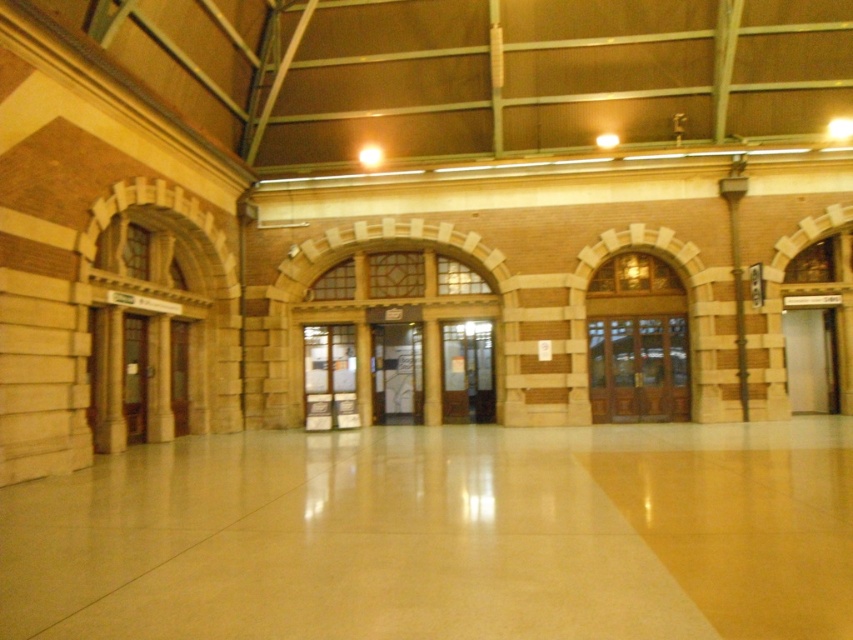
Question: Which point is farther to the camera?

Choices:
 (A) translucent glass door at center
 (B) satin silver door at right

Answer: (A)

Question: Among these objects, which one is nearest to the camera?

Choices:
 (A) brown wooden door at center
 (B) transparent glass door at center
 (C) wooden door at left

Answer: (C)

Question: Can you confirm if satin silver door at right is positioned below wooden door at left?

Choices:
 (A) yes
 (B) no

Answer: (B)

Question: Is transparent glass door at center in front of wooden door at left?

Choices:
 (A) no
 (B) yes

Answer: (A)

Question: Does translucent glass door at center appear on the right side of wooden door at center?

Choices:
 (A) no
 (B) yes

Answer: (A)

Question: Which of the following is the closest to the observer?

Choices:
 (A) (143, 349)
 (B) (671, 396)
 (C) (492, 356)

Answer: (A)